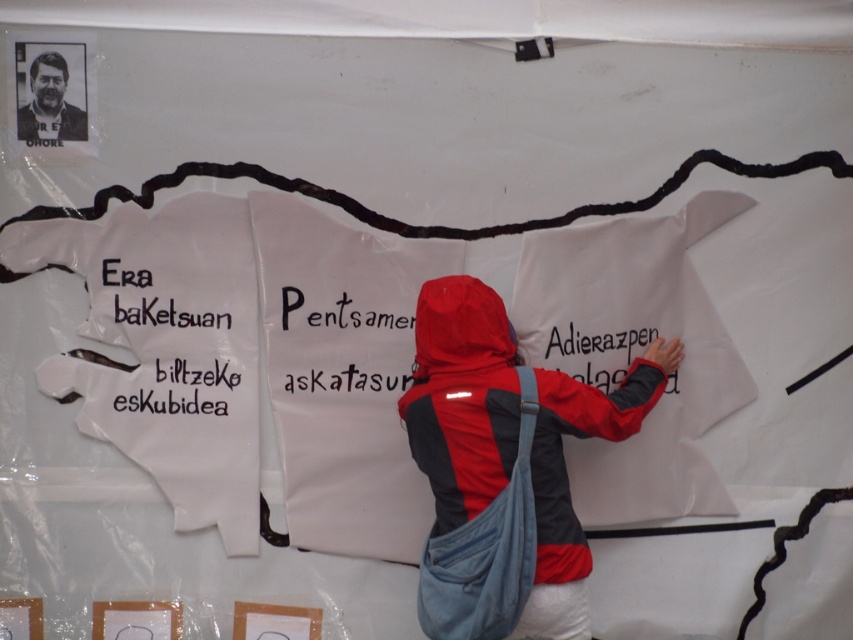
You are trying to locate two specific points on the white surface in the image. The first point is at coordinates point (425,333) and the second is at point (213,387). Which point is closer to the viewer?

Point (425,333) is in front of point (213,387), so it is closer to the viewer.

You are an observer looking at the scene. There is a black paper at left and a matte black jacket at upper left. Which object is positioned more to the right?

The black paper at left is positioned more to the right than the matte black jacket at upper left.